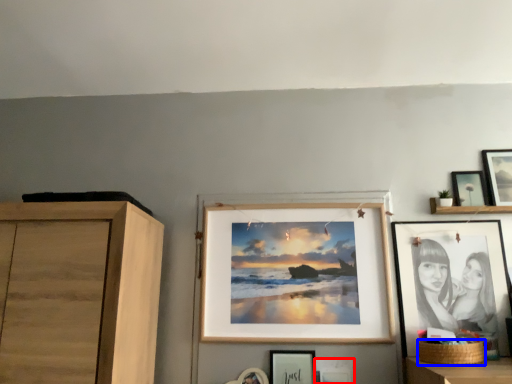
Question: Which point is closer to the camera, picture frame (highlighted by a red box) or basket (highlighted by a blue box)?

Choices:
 (A) picture frame
 (B) basket

Answer: (B)